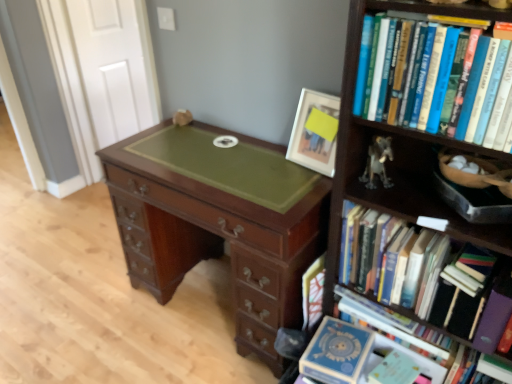
Question: From the image's perspective, is hardcover books at upper right, which is the first book from top to bottom, under hardcover books at right, marked as the first book in a bottom-to-top arrangement?

Choices:
 (A) no
 (B) yes

Answer: (A)

Question: Is hardcover books at upper right, which is the first book from top to bottom, next to hardcover books at right, which is the fourth book in top-to-bottom order, and touching it?

Choices:
 (A) yes
 (B) no

Answer: (B)

Question: Can hardcover books at right, marked as the first book in a bottom-to-top arrangement, be found inside hardcover books at upper right, which is the first book from top to bottom?

Choices:
 (A) no
 (B) yes

Answer: (A)

Question: Is hardcover books at upper right, the fourth book from the bottom, taller than hardcover books at right, marked as the first book in a bottom-to-top arrangement?

Choices:
 (A) yes
 (B) no

Answer: (B)

Question: Considering the relative sizes of hardcover books at upper right, the fourth book from the bottom, and hardcover books at right, marked as the first book in a bottom-to-top arrangement, in the image provided, is hardcover books at upper right, the fourth book from the bottom, smaller than hardcover books at right, marked as the first book in a bottom-to-top arrangement,?

Choices:
 (A) yes
 (B) no

Answer: (A)

Question: Is hardcover books at right, marked as the first book in a bottom-to-top arrangement, situated inside hardcover book at center, the 2th book ordered from the bottom, or outside?

Choices:
 (A) inside
 (B) outside

Answer: (B)

Question: Considering their positions, is hardcover books at right, marked as the first book in a bottom-to-top arrangement, located in front of or behind hardcover book at center, acting as the third book starting from the top?

Choices:
 (A) front
 (B) behind

Answer: (A)

Question: Is hardcover books at right, marked as the first book in a bottom-to-top arrangement, to the left or to the right of hardcover book at center, acting as the third book starting from the top, in the image?

Choices:
 (A) right
 (B) left

Answer: (A)

Question: From a real-world perspective, is hardcover books at right, marked as the first book in a bottom-to-top arrangement, positioned above or below hardcover book at center, acting as the third book starting from the top?

Choices:
 (A) above
 (B) below

Answer: (B)

Question: From a real-world perspective, is wooden bookcase at right physically located above or below hardcover book at center, acting as the third book starting from the top?

Choices:
 (A) above
 (B) below

Answer: (A)

Question: Relative to hardcover book at center, the 2th book ordered from the bottom, is wooden bookcase at right in front or behind?

Choices:
 (A) front
 (B) behind

Answer: (A)

Question: Is point (422, 134) closer or farther from the camera than point (315, 268)?

Choices:
 (A) closer
 (B) farther

Answer: (A)

Question: From the image's perspective, is wooden bookcase at right positioned above or below hardcover book at center, acting as the third book starting from the top?

Choices:
 (A) above
 (B) below

Answer: (A)

Question: Considering the relative positions of mahogany wood desk at center and wooden bookcase at right in the image provided, is mahogany wood desk at center to the left or to the right of wooden bookcase at right?

Choices:
 (A) right
 (B) left

Answer: (B)

Question: Is mahogany wood desk at center situated inside wooden bookcase at right or outside?

Choices:
 (A) outside
 (B) inside

Answer: (A)